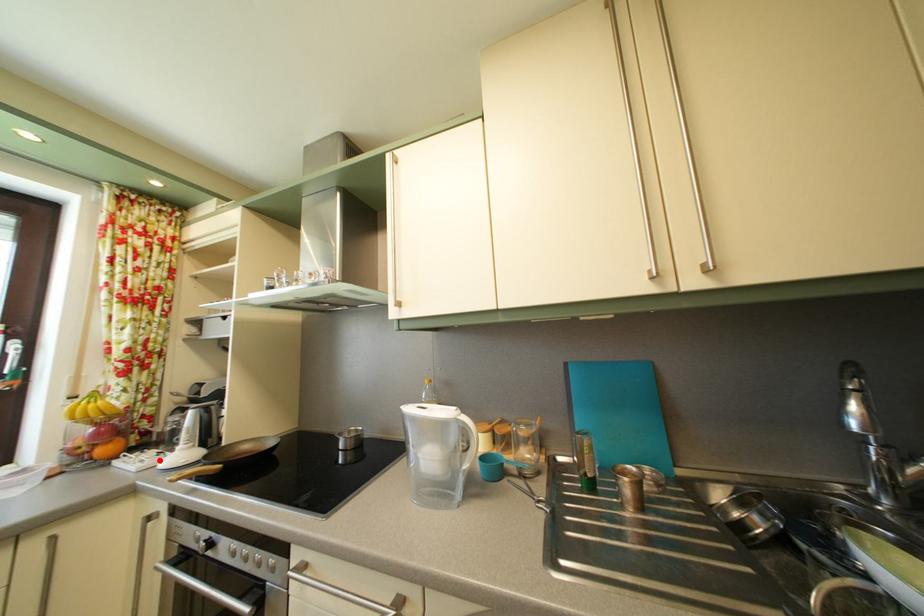
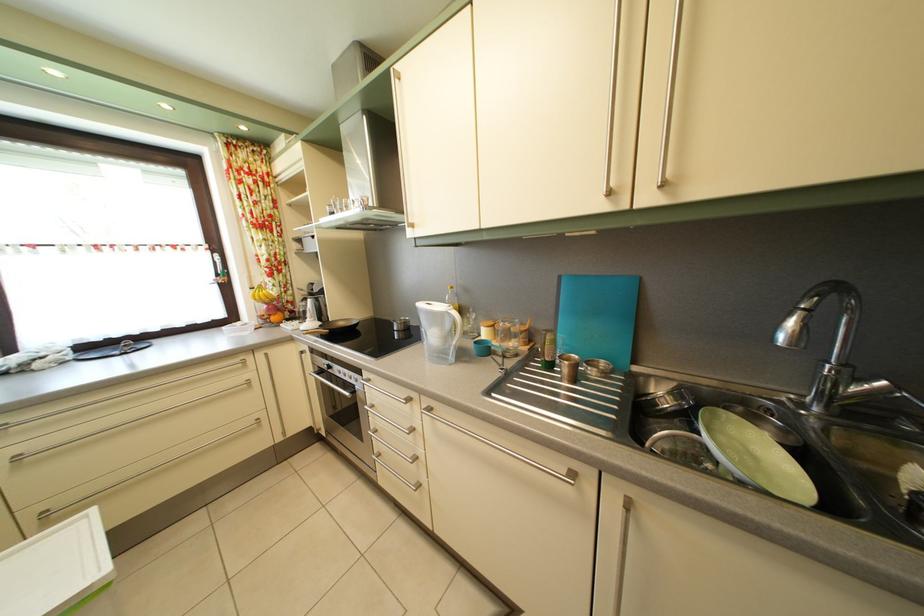
Locate, in the second image, the point that corresponds to the highlighted location in the first image.

(305, 330)